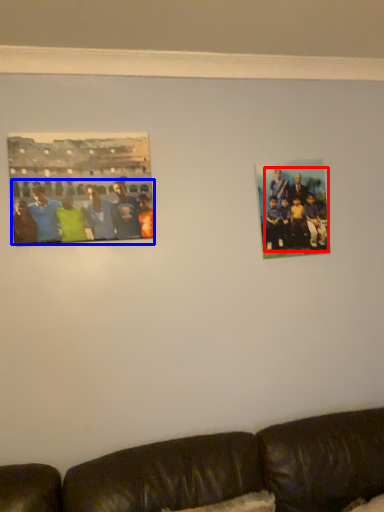
Question: Which of the following is the closest to the observer, person (highlighted by a red box) or person (highlighted by a blue box)?

Choices:
 (A) person
 (B) person

Answer: (B)